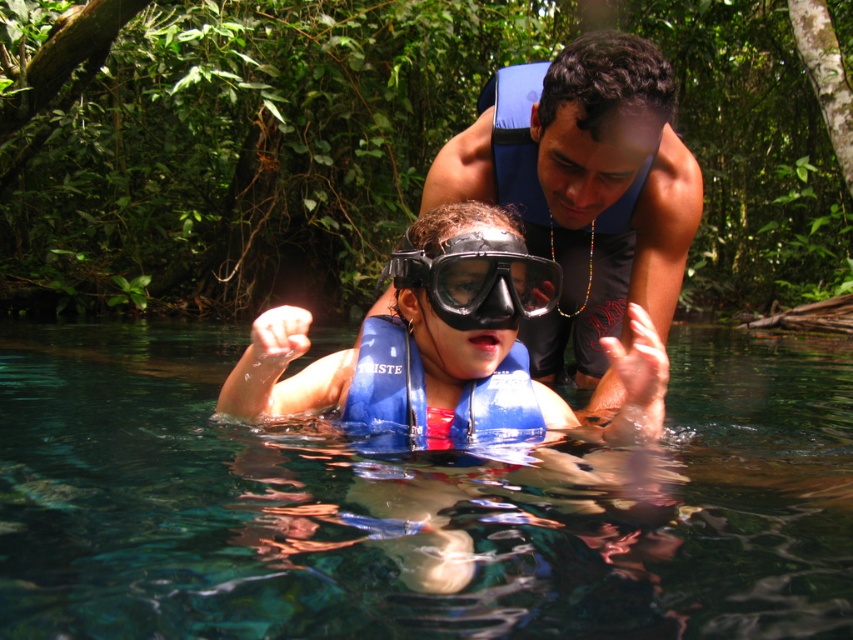
Question: In this image, where is blue matte life vest at center located relative to black matte goggles at center?

Choices:
 (A) above
 (B) below

Answer: (B)

Question: Which point appears farthest from the camera in this image?

Choices:
 (A) (351, 420)
 (B) (323, 403)
 (C) (451, 268)

Answer: (B)

Question: Which point is farther to the camera?

Choices:
 (A) (413, 634)
 (B) (521, 259)
 (C) (386, 422)

Answer: (C)

Question: Can you confirm if transparent blue life vest at center is wider than blue life vest at upper center?

Choices:
 (A) no
 (B) yes

Answer: (B)

Question: Can you confirm if blue matte life vest at center is positioned to the right of blue matte life jacket at center?

Choices:
 (A) yes
 (B) no

Answer: (A)

Question: Among these points, which one is nearest to the camera?

Choices:
 (A) (462, 240)
 (B) (407, 611)
 (C) (483, 240)

Answer: (B)